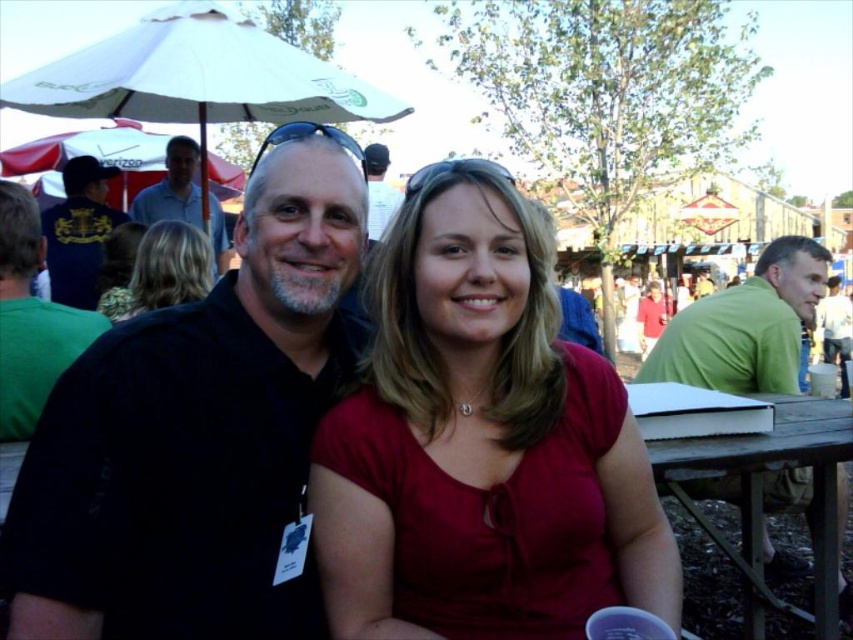
Can you confirm if green cotton shirt at left is positioned below light blue shirt at upper left?

Yes.

Describe the element at coordinates (32, 320) in the screenshot. This screenshot has width=853, height=640. I see `green cotton shirt at left` at that location.

This screenshot has width=853, height=640. In order to click on green cotton shirt at left in this screenshot , I will do `click(32, 320)`.

Describe the element at coordinates (93, 156) in the screenshot. This screenshot has width=853, height=640. I see `red fabric umbrella at upper left` at that location.

Does red fabric umbrella at upper left lie behind light blue shirt at upper left?

Yes, red fabric umbrella at upper left is further from the viewer.

Who is more forward, (x=152, y=157) or (x=192, y=209)?

Point (x=192, y=209) is more forward.

I want to click on red fabric umbrella at upper left, so click(x=93, y=156).

Does black matte shirt at center have a greater width compared to green cotton shirt at left?

Yes.

In the scene shown: Does black matte shirt at center have a lesser width compared to green cotton shirt at left?

No, black matte shirt at center is not thinner than green cotton shirt at left.

In order to click on black matte shirt at center in this screenshot , I will do `click(199, 429)`.